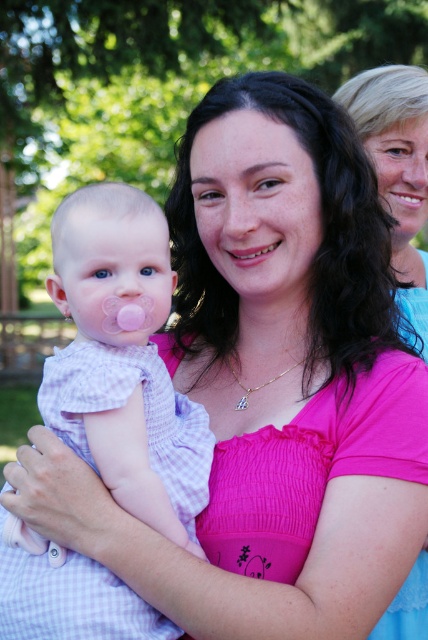
Question: Which of the following is the farthest from the observer?

Choices:
 (A) (400, 189)
 (B) (416, 252)
 (C) (199, 416)

Answer: (B)

Question: Which of the following is the farthest from the observer?

Choices:
 (A) pink fabric shirt at center
 (B) smooth skin mouth at upper right
 (C) pink checkered fabric at left

Answer: (B)

Question: Does pink fabric shirt at center appear on the left side of smooth skin mouth at upper right?

Choices:
 (A) yes
 (B) no

Answer: (A)

Question: Is pink fabric shirt at center to the right of smooth skin at center from the viewer's perspective?

Choices:
 (A) no
 (B) yes

Answer: (B)

Question: Can you confirm if pink checkered fabric at left is positioned to the right of smooth skin mouth at upper right?

Choices:
 (A) yes
 (B) no

Answer: (B)

Question: Among these points, which one is nearest to the camera?

Choices:
 (A) (401, 189)
 (B) (356, 124)
 (C) (255, 244)
 (D) (77, 216)

Answer: (D)